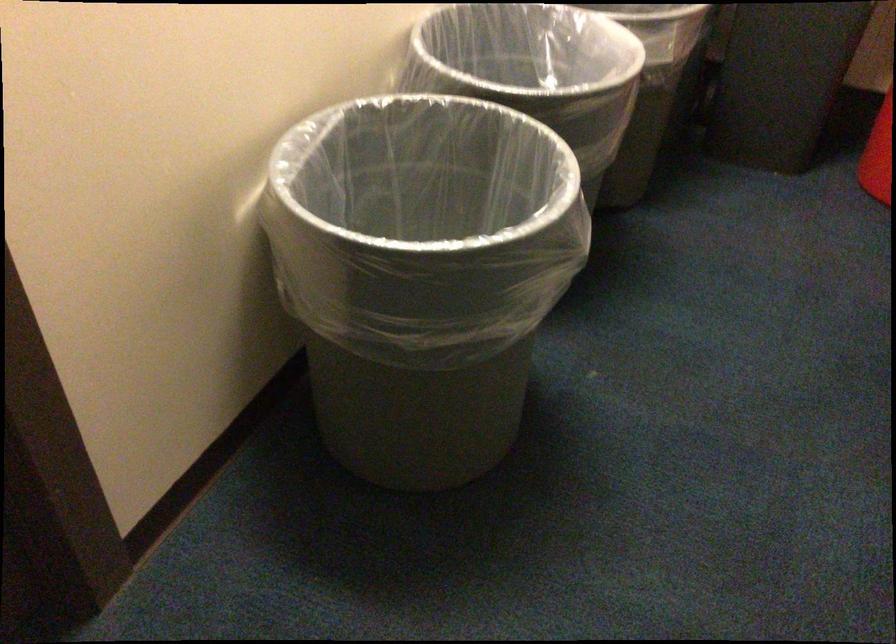
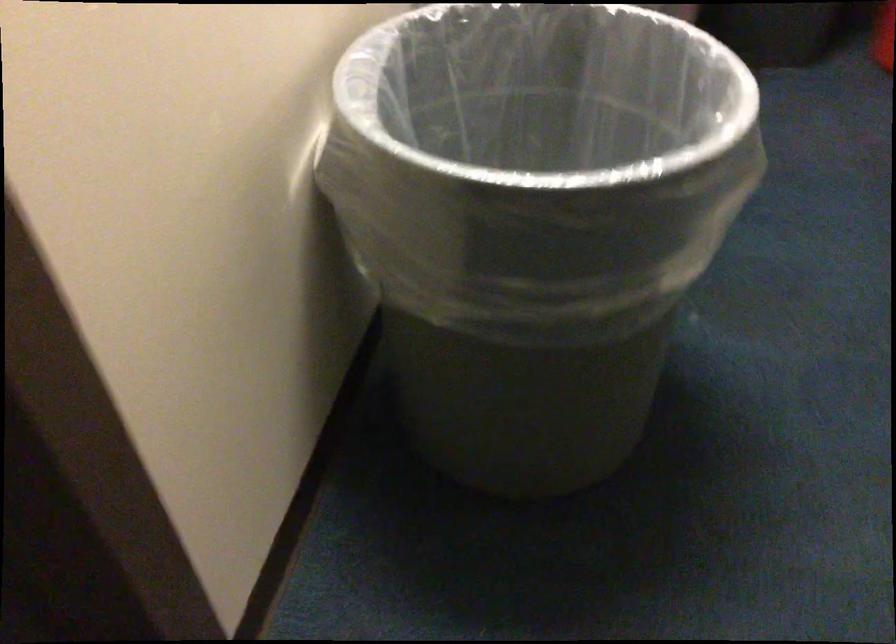
In the second image, find the point that corresponds to point (369, 243) in the first image.

(538, 185)